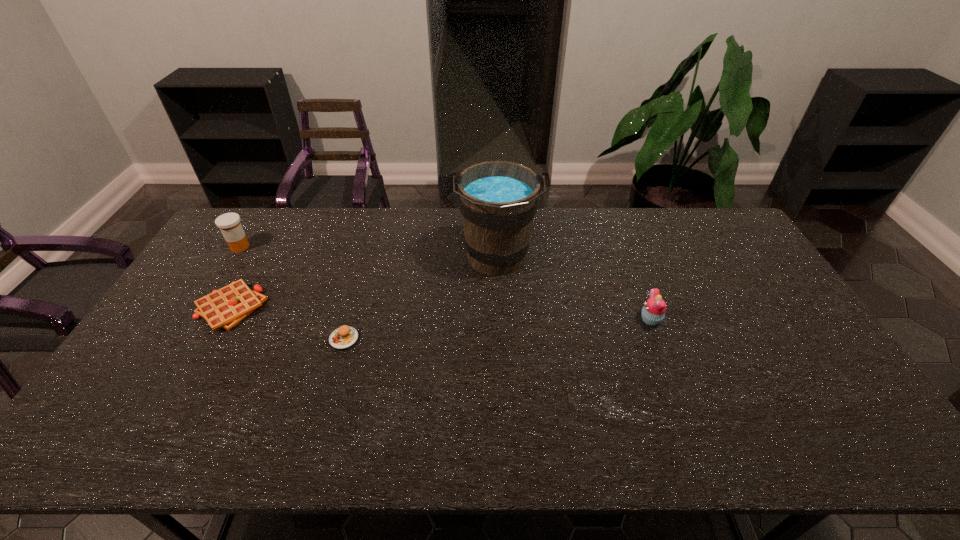
Locate an element on the screen. The image size is (960, 540). free region at the near edge of the desktop is located at coordinates [696, 438].

This screenshot has height=540, width=960. Identify the location of vacant space at the left edge of the desktop. (132, 397).

Find the location of a particular element. vacant region at the right edge of the desktop is located at coordinates (784, 338).

Find the location of a particular element. The width and height of the screenshot is (960, 540). vacant space at the far left corner of the desktop is located at coordinates (220, 247).

In the image, there is a desktop. Where is `vacant space at the far right corner`? This screenshot has height=540, width=960. vacant space at the far right corner is located at coordinates (707, 234).

Image resolution: width=960 pixels, height=540 pixels. In order to click on free area in between the tallest object and the patty in this screenshot , I will do `click(420, 299)`.

The image size is (960, 540). What are the coordinates of `free space between the fourth object from left to right and the third shortest object` in the screenshot? It's located at (x=573, y=289).

At what (x,y) coordinates should I click in order to perform the action: click on vacant area that lies between the waffle and the third object from left to right. Please return your answer as a coordinate pair (x, y). This screenshot has height=540, width=960. Looking at the image, I should click on (287, 323).

Locate an element on the screen. The image size is (960, 540). vacant area that lies between the patty and the wine bucket is located at coordinates (420, 299).

Find the location of `vacant area between the wine bucket and the third object from right to left`. vacant area between the wine bucket and the third object from right to left is located at coordinates (420, 299).